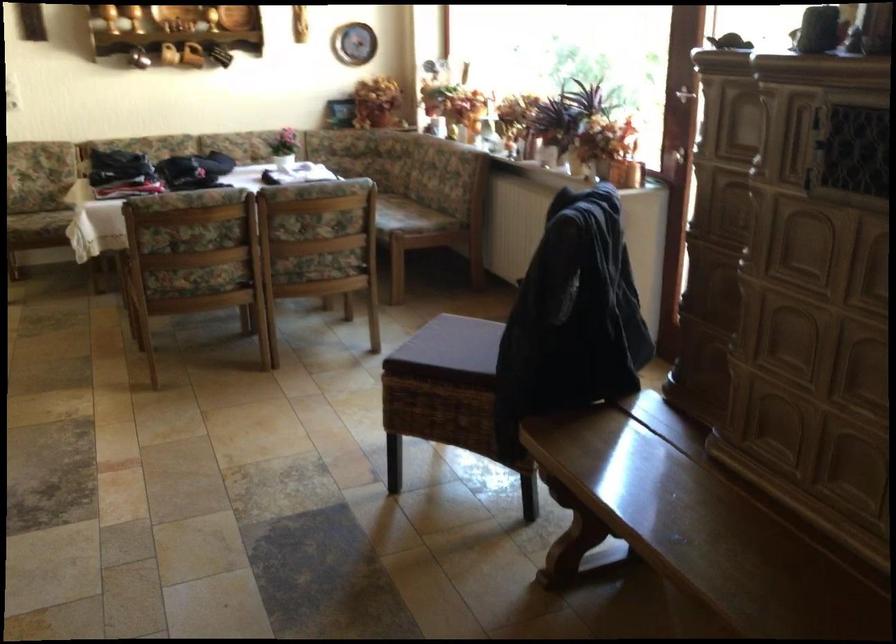
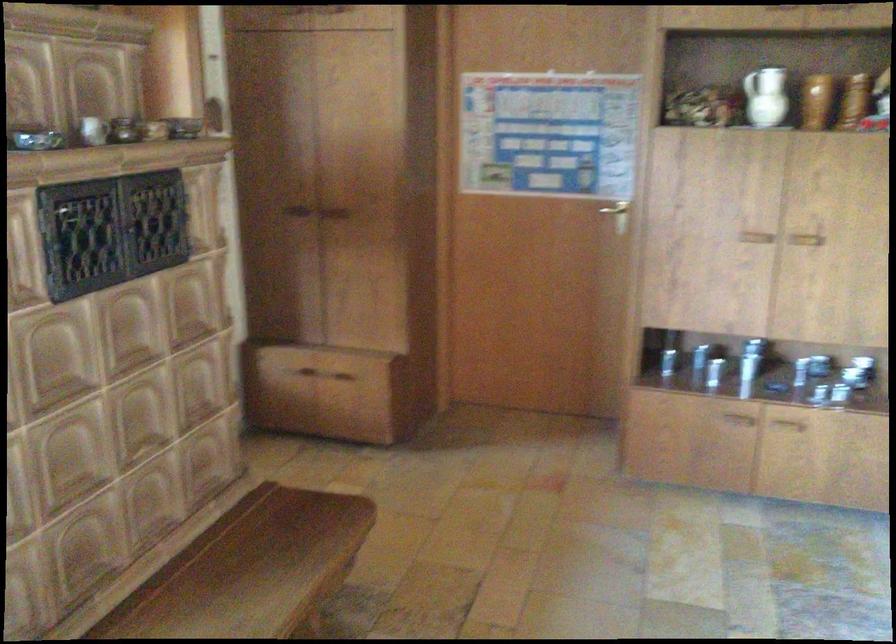
Locate, in the second image, the point that corresponds to the point at 789,574 in the first image.

(252, 570)